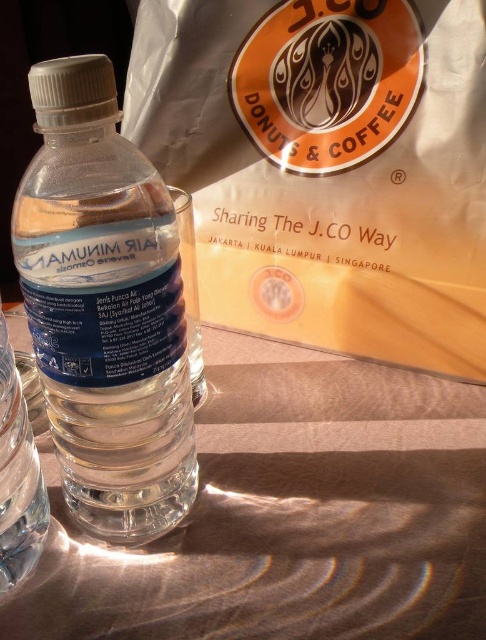
Question: Which object is closer to the camera taking this photo?

Choices:
 (A) translucent plastic water at center
 (B) clear plastic bottle at center

Answer: (B)

Question: Is translucent plastic water at center bigger than clear plastic bottle at center?

Choices:
 (A) no
 (B) yes

Answer: (B)

Question: Can you confirm if translucent plastic water at center is positioned below clear plastic bottle at center?

Choices:
 (A) yes
 (B) no

Answer: (A)

Question: Is translucent plastic water at center to the left of clear plastic bottle at center from the viewer's perspective?

Choices:
 (A) no
 (B) yes

Answer: (A)

Question: Which point appears closest to the camera in this image?

Choices:
 (A) (62, 580)
 (B) (163, 512)

Answer: (A)